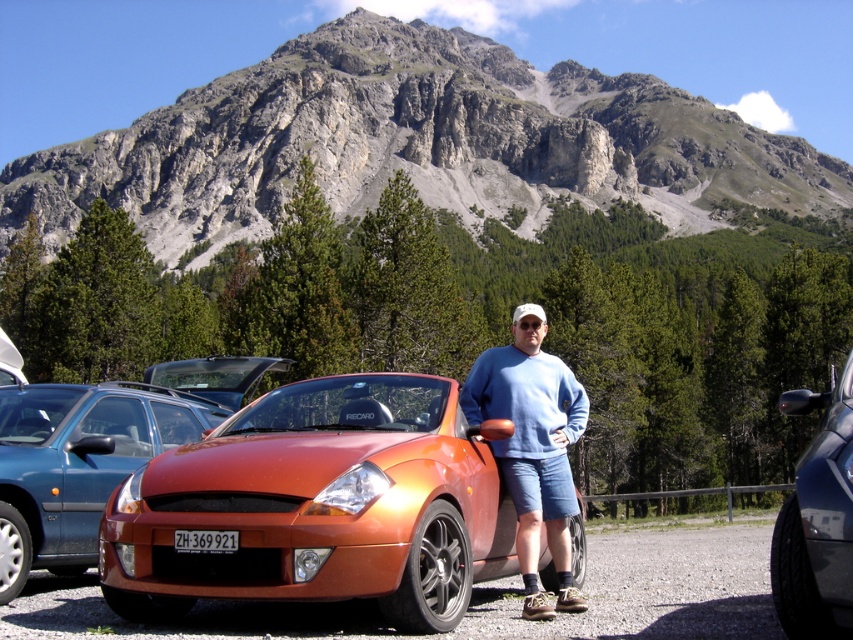
From the picture: Who is more distant from viewer, (480,600) or (845,579)?

The point (480,600) is behind.

Locate an element on the screen. The image size is (853, 640). metallic orange car at center is located at coordinates (651, 586).

Is shiny orange sports car at center taller than black plastic license plate at center?

Yes.

Consider the image. Does shiny orange sports car at center appear over black plastic license plate at center?

Yes, shiny orange sports car at center is above black plastic license plate at center.

Locate an element on the screen. The image size is (853, 640). shiny orange sports car at center is located at coordinates (320, 506).

Between point (825, 486) and point (184, 538), which one is positioned in front?

Positioned in front is point (825, 486).

Who is positioned more to the left, glossy metallic car at center or black plastic license plate at center?

Positioned to the left is black plastic license plate at center.

Locate an element on the screen. The height and width of the screenshot is (640, 853). glossy metallic car at center is located at coordinates (817, 518).